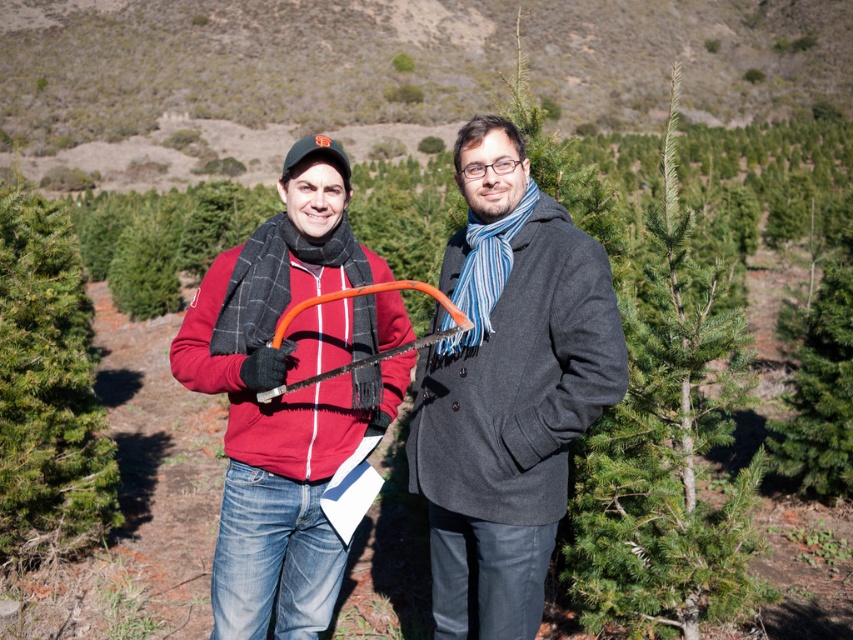
Can you confirm if green needle-like at left is positioned to the left of orange plastic saw at center?

Correct, you'll find green needle-like at left to the left of orange plastic saw at center.

Find the location of a particular element. Image resolution: width=853 pixels, height=640 pixels. green needle-like at left is located at coordinates (47, 387).

Does point (67, 234) lie in front of point (257, 394)?

No, (67, 234) is further to viewer.

Where is `green needle-like at left`? The height and width of the screenshot is (640, 853). green needle-like at left is located at coordinates (47, 387).

Who is taller, charcoal wool coat at center or green needle-like at left?

green needle-like at left

Is charcoal wool coat at center smaller than green needle-like at left?

Correct, charcoal wool coat at center occupies less space than green needle-like at left.

Where is `charcoal wool coat at center`? Image resolution: width=853 pixels, height=640 pixels. charcoal wool coat at center is located at coordinates (508, 388).

Is charcoal wool coat at center in front of orange plastic saw at center?

No, it is not.

Does point (422, 400) come farther from viewer compared to point (271, 392)?

Yes, it is behind point (271, 392).

Identify the location of charcoal wool coat at center. (508, 388).